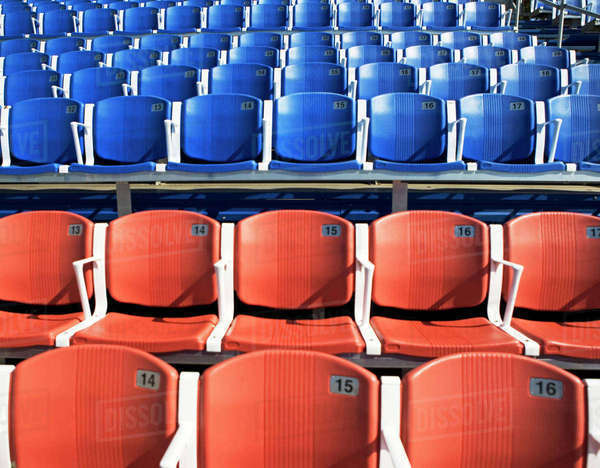
Locate an element on the screen. The height and width of the screenshot is (468, 600). red chairs is located at coordinates (101, 410), (319, 405), (495, 396), (571, 270), (433, 281), (290, 266), (162, 261), (51, 261).